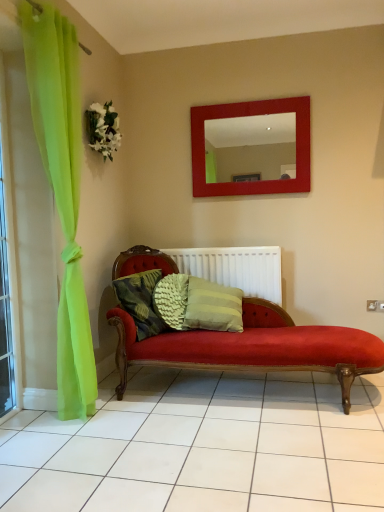
Question: From the image's perspective, is white fabric flower at upper left located above clear glass window at left?

Choices:
 (A) no
 (B) yes

Answer: (B)

Question: Is white fabric flower at upper left directly adjacent to clear glass window at left?

Choices:
 (A) yes
 (B) no

Answer: (B)

Question: Can you confirm if white fabric flower at upper left is smaller than clear glass window at left?

Choices:
 (A) no
 (B) yes

Answer: (B)

Question: Is white fabric flower at upper left completely or partially outside of clear glass window at left?

Choices:
 (A) yes
 (B) no

Answer: (A)

Question: Is white fabric flower at upper left taller than clear glass window at left?

Choices:
 (A) no
 (B) yes

Answer: (A)

Question: Is white plastic radiator at center spatially inside clear glass window at left, or outside of it?

Choices:
 (A) outside
 (B) inside

Answer: (A)

Question: Would you say white plastic radiator at center is to the left or to the right of clear glass window at left in the picture?

Choices:
 (A) right
 (B) left

Answer: (A)

Question: Considering their positions, is white plastic radiator at center located in front of or behind clear glass window at left?

Choices:
 (A) front
 (B) behind

Answer: (B)

Question: Considering the positions of white plastic radiator at center and clear glass window at left in the image, is white plastic radiator at center wider or thinner than clear glass window at left?

Choices:
 (A) thin
 (B) wide

Answer: (B)

Question: Is textured green pillow at center bigger or smaller than clear glass window at left?

Choices:
 (A) big
 (B) small

Answer: (B)

Question: From the image's perspective, is textured green pillow at center positioned above or below clear glass window at left?

Choices:
 (A) below
 (B) above

Answer: (A)

Question: Is textured green pillow at center inside the boundaries of clear glass window at left, or outside?

Choices:
 (A) outside
 (B) inside

Answer: (A)

Question: Is textured green pillow at center taller or shorter than clear glass window at left?

Choices:
 (A) short
 (B) tall

Answer: (A)

Question: From the image's perspective, is white fabric flower at upper left above or below clear glass window at left?

Choices:
 (A) below
 (B) above

Answer: (B)

Question: Looking at the image, does white fabric flower at upper left seem bigger or smaller compared to clear glass window at left?

Choices:
 (A) big
 (B) small

Answer: (B)